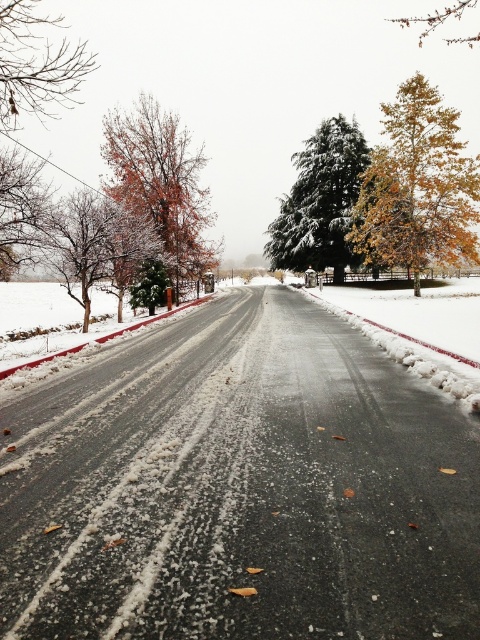
You are a hiker standing at the starting point of the snowy road and see the bare branches at upper left and the bare branches at left in the scene. Which direction should you walk to get closer to both of them at the same time?

Since the bare branches at upper left and bare branches at left are 47.11 meters apart, walking straight ahead along the road would bring you closer to both as they are positioned along the road in the distance.

You are a photographer standing on the snowy road and want to capture both the bare branches at upper left and the bare branches at left in a single photo. Which of the two bare branches groups should you focus on first to ensure both are in frame?

You should focus on the bare branches at left first because the bare branches at upper left is located above it, so by centering the lower one, you can adjust the camera angle to include both.